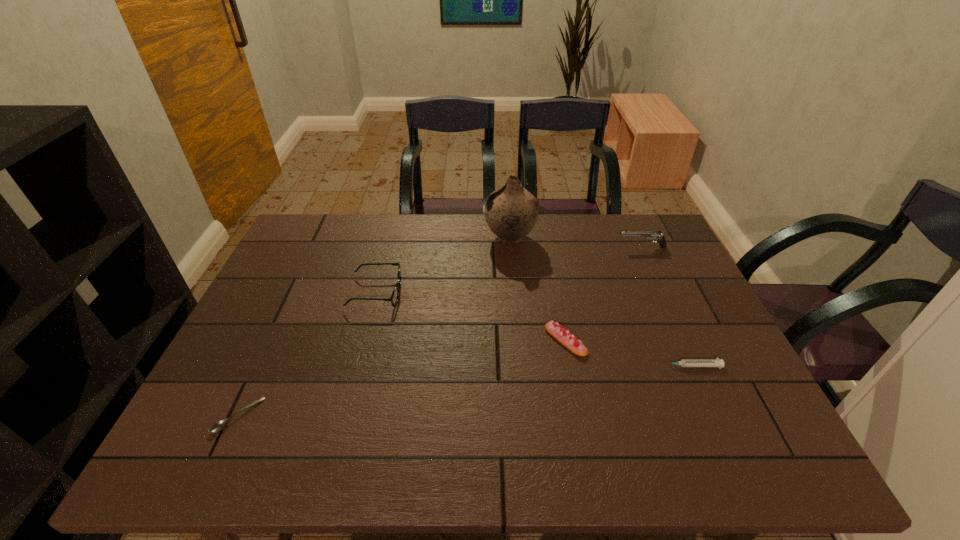
Where is `blank space at the far edge of the desktop`? The image size is (960, 540). blank space at the far edge of the desktop is located at coordinates (570, 223).

The width and height of the screenshot is (960, 540). In order to click on free spot at the near edge of the desktop in this screenshot , I will do `click(635, 463)`.

Where is `free region at the left edge of the desktop`? Image resolution: width=960 pixels, height=540 pixels. free region at the left edge of the desktop is located at coordinates tap(203, 426).

This screenshot has height=540, width=960. I want to click on vacant space at the right edge of the desktop, so click(x=702, y=323).

In the image, there is a desktop. Where is `free space at the far left corner`? The height and width of the screenshot is (540, 960). free space at the far left corner is located at coordinates (286, 245).

I want to click on free region at the near left corner of the desktop, so click(180, 445).

Find the location of a particular element. This screenshot has width=960, height=540. vacant space at the far right corner is located at coordinates (614, 221).

Locate an element on the screen. The image size is (960, 540). free space between the third tallest object and the tallest object is located at coordinates tap(443, 265).

Find the location of a particular element. empty location between the second nearest object and the eclair is located at coordinates (628, 353).

The width and height of the screenshot is (960, 540). Identify the location of free space between the third tallest object and the second shortest object. (533, 329).